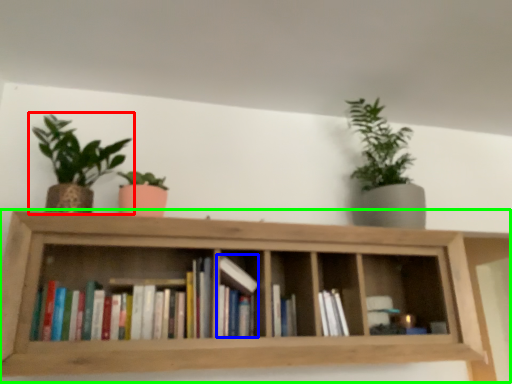
Question: Considering the real-world distances, which object is closest to houseplant (highlighted by a red box)? book (highlighted by a blue box) or shelf (highlighted by a green box).

Choices:
 (A) book
 (B) shelf

Answer: (B)